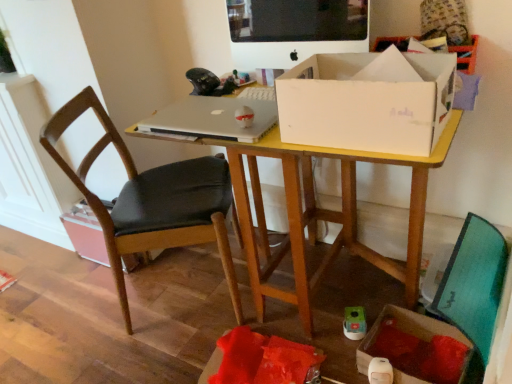
Question: Can you confirm if yellow wood desk at center is shorter than white cardboard box at center?

Choices:
 (A) no
 (B) yes

Answer: (A)

Question: Is yellow wood desk at center positioned before white cardboard box at center?

Choices:
 (A) yes
 (B) no

Answer: (B)

Question: Can you confirm if yellow wood desk at center is bigger than white cardboard box at center?

Choices:
 (A) yes
 (B) no

Answer: (A)

Question: Can you confirm if yellow wood desk at center is smaller than white cardboard box at center?

Choices:
 (A) yes
 (B) no

Answer: (B)

Question: Can you confirm if yellow wood desk at center is wider than white cardboard box at center?

Choices:
 (A) yes
 (B) no

Answer: (A)

Question: Is yellow wood desk at center far away from white cardboard box at center?

Choices:
 (A) yes
 (B) no

Answer: (B)

Question: Is cardboard box at lower right, the 2th cardboard box when ordered from left to right, smaller than black leather chair at left, which is the 2th cardboard box from front to back?

Choices:
 (A) yes
 (B) no

Answer: (A)

Question: Is cardboard box at lower right, the 2th cardboard box positioned from the back, oriented away from black leather chair at left, placed as the first cardboard box when sorted from top to bottom?

Choices:
 (A) yes
 (B) no

Answer: (B)

Question: From the image's perspective, is cardboard box at lower right, the 2th cardboard box positioned from the back, over black leather chair at left, which is counted as the 1th cardboard box, starting from the back?

Choices:
 (A) no
 (B) yes

Answer: (A)

Question: Is cardboard box at lower right, the 1th cardboard box positioned from the right, positioned behind black leather chair at left, which is the 2th cardboard box from front to back?

Choices:
 (A) yes
 (B) no

Answer: (B)

Question: Considering the relative sizes of cardboard box at lower right, the 2th cardboard box when ordered from left to right, and black leather chair at left, which is counted as the 1th cardboard box, starting from the back, in the image provided, is cardboard box at lower right, the 2th cardboard box when ordered from left to right, taller than black leather chair at left, which is counted as the 1th cardboard box, starting from the back,?

Choices:
 (A) no
 (B) yes

Answer: (A)

Question: Is cardboard box at lower right, the 2th cardboard box positioned from the back, placed right next to black leather chair at left, the 1th cardboard box when ordered from left to right?

Choices:
 (A) yes
 (B) no

Answer: (B)

Question: Is cardboard box at lower right, placed as the 1th cardboard box when sorted from front to back, facing away from matte black monitor at upper center?

Choices:
 (A) no
 (B) yes

Answer: (A)